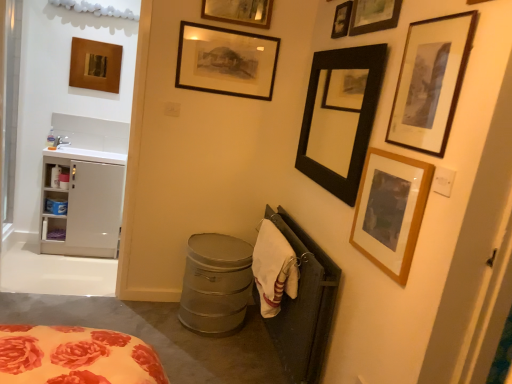
Image resolution: width=512 pixels, height=384 pixels. What do you see at coordinates (430, 82) in the screenshot?
I see `wooden framed print at upper right, the 8th picture frame positioned from the left` at bounding box center [430, 82].

Where is `wooden framed print at upper right, the 1th picture frame when ordered from right to left`? Image resolution: width=512 pixels, height=384 pixels. wooden framed print at upper right, the 1th picture frame when ordered from right to left is located at coordinates (430, 82).

The height and width of the screenshot is (384, 512). Describe the element at coordinates (390, 210) in the screenshot. I see `wooden picture frame at upper right, the 3th picture frame in the right-to-left sequence` at that location.

The image size is (512, 384). I want to click on black metal radiator at lower right, so click(304, 305).

Where is `matte black picture frame at upper center, the 2th picture frame from the left`? The height and width of the screenshot is (384, 512). matte black picture frame at upper center, the 2th picture frame from the left is located at coordinates tap(226, 61).

Where is `white matte cabinet at left`? This screenshot has width=512, height=384. white matte cabinet at left is located at coordinates (83, 203).

The width and height of the screenshot is (512, 384). What are the coordinates of `wooden picture frame at upper left, arranged as the 8th picture frame when viewed from the right` in the screenshot? It's located at (95, 65).

Would you say metallic gray trash can at lower center is part of black matte picture frame at upper right, which is the 5th picture frame from right to left,'s contents?

No, metallic gray trash can at lower center is not surrounded by black matte picture frame at upper right, which is the 5th picture frame from right to left.

Is black matte picture frame at upper right, the fourth picture frame positioned from the left, not close to metallic gray trash can at lower center?

black matte picture frame at upper right, the fourth picture frame positioned from the left, is near metallic gray trash can at lower center, not far away.

Considering the positions of objects black matte picture frame at upper right, which is the 5th picture frame from right to left, and metallic gray trash can at lower center in the image provided, who is more to the right, black matte picture frame at upper right, which is the 5th picture frame from right to left, or metallic gray trash can at lower center?

Positioned to the right is black matte picture frame at upper right, which is the 5th picture frame from right to left.

From the image's perspective, does wooden picture frame at upper right, acting as the 7th picture frame starting from the left, appear lower than white glossy sink at left?

No, from the image's perspective, wooden picture frame at upper right, acting as the 7th picture frame starting from the left, is not below white glossy sink at left.

How many degrees apart are the facing directions of wooden picture frame at upper right, arranged as the second picture frame when viewed from the right, and white glossy sink at left?

The angle between the facing direction of wooden picture frame at upper right, arranged as the second picture frame when viewed from the right, and the facing direction of white glossy sink at left is 90 degrees.

Considering their positions, is wooden picture frame at upper right, arranged as the second picture frame when viewed from the right, located in front of or behind white glossy sink at left?

Visually, wooden picture frame at upper right, arranged as the second picture frame when viewed from the right, is located in front of white glossy sink at left.

Find the location of `sink on the left of wooden picture frame at upper right, arranged as the second picture frame when viewed from the right`. sink on the left of wooden picture frame at upper right, arranged as the second picture frame when viewed from the right is located at coordinates (87, 155).

From the picture: Considering the sizes of objects white cotton towel at lower right and white plastic cabinet at left in the image provided, who is shorter, white cotton towel at lower right or white plastic cabinet at left?

With less height is white plastic cabinet at left.

In the scene shown: Is white cotton towel at lower right aimed at white plastic cabinet at left?

No, white cotton towel at lower right is not facing towards white plastic cabinet at left.

Considering the sizes of objects white cotton towel at lower right and white plastic cabinet at left in the image provided, who is smaller, white cotton towel at lower right or white plastic cabinet at left?

white plastic cabinet at left is smaller.

From the picture: Which is further, [270,261] or [60,209]?

The point [60,209] is more distant.

In the scene shown: Can you see wooden picture frame at upper right, acting as the 7th picture frame starting from the left, touching metallic gray trash can at lower center?

wooden picture frame at upper right, acting as the 7th picture frame starting from the left, and metallic gray trash can at lower center are clearly separated.

From the picture: Choose the correct answer: Is wooden picture frame at upper right, acting as the 7th picture frame starting from the left, inside metallic gray trash can at lower center or outside it?

wooden picture frame at upper right, acting as the 7th picture frame starting from the left, exists outside the volume of metallic gray trash can at lower center.

This screenshot has width=512, height=384. What are the coordinates of `the 8th picture frame located above the metallic gray trash can at lower center (from a real-world perspective)` in the screenshot? It's located at (374, 16).

Is wooden picture frame at upper right, arranged as the second picture frame when viewed from the right, taller than metallic gray trash can at lower center?

No.

Which of these two, matte black picture frame at upper center, the 2th picture frame from the left, or white cotton towel at lower right, stands taller?

With more height is white cotton towel at lower right.

From a real-world perspective, between matte black picture frame at upper center, positioned as the 7th picture frame in right-to-left order, and white cotton towel at lower right, who is vertically lower?

white cotton towel at lower right is physically lower.

Does matte black picture frame at upper center, positioned as the 7th picture frame in right-to-left order, turn towards white cotton towel at lower right?

No, matte black picture frame at upper center, positioned as the 7th picture frame in right-to-left order, is not turned towards white cotton towel at lower right.

Who is more distant, matte black picture frame at upper center, the 2th picture frame from the left, or white cotton towel at lower right?

matte black picture frame at upper center, the 2th picture frame from the left.

Are matte black picture frame at upper center, the 2th picture frame from the left, and wooden picture frame at upper right, the 6th picture frame when ordered from left to right, making contact?

No, matte black picture frame at upper center, the 2th picture frame from the left, is not making contact with wooden picture frame at upper right, the 6th picture frame when ordered from left to right.

Is matte black picture frame at upper center, the 2th picture frame from the left, at the right side of wooden picture frame at upper right, the 3th picture frame in the right-to-left sequence?

In fact, matte black picture frame at upper center, the 2th picture frame from the left, is to the left of wooden picture frame at upper right, the 3th picture frame in the right-to-left sequence.

Considering the relative positions of matte black picture frame at upper center, the 2th picture frame from the left, and wooden picture frame at upper right, the 3th picture frame in the right-to-left sequence, in the image provided, is matte black picture frame at upper center, the 2th picture frame from the left, behind wooden picture frame at upper right, the 3th picture frame in the right-to-left sequence,?

Yes, it is.

Could you tell me if matte black picture frame at upper center, positioned as the 7th picture frame in right-to-left order, is turned towards wooden picture frame at upper right, the 6th picture frame when ordered from left to right?

Yes, matte black picture frame at upper center, positioned as the 7th picture frame in right-to-left order, is facing wooden picture frame at upper right, the 6th picture frame when ordered from left to right.

Is point (60, 239) closer or farther from the camera than point (359, 34)?

Point (60, 239) is positioned farther from the camera compared to point (359, 34).

Based on the photo, from a real-world perspective, is white matte cabinet at left under wooden picture frame at upper right, arranged as the second picture frame when viewed from the right?

Yes, from a real-world perspective, white matte cabinet at left is beneath wooden picture frame at upper right, arranged as the second picture frame when viewed from the right.

From the image's perspective, which picture frame is the 3rd one above the metallic gray trash can at lower center? Please provide its 2D coordinates.

[(340, 118)]

Where is `sink lying on the left of wooden picture frame at upper right, acting as the 7th picture frame starting from the left`? Image resolution: width=512 pixels, height=384 pixels. sink lying on the left of wooden picture frame at upper right, acting as the 7th picture frame starting from the left is located at coordinates (87, 155).

From the picture: Looking at the image, which one is located further to wooden framed print at upper right, the 8th picture frame positioned from the left, white glossy sink at left or wooden framed picture at upper center, which ranks as the 3th picture frame in left-to-right order?

white glossy sink at left is further to wooden framed print at upper right, the 8th picture frame positioned from the left.

Based on their spatial positions, is wooden picture frame at upper left, the 1th picture frame from the left, or wooden framed picture at upper center, the sixth picture frame from the right, closer to white glossy sink at left?

Among the two, wooden picture frame at upper left, the 1th picture frame from the left, is located nearer to white glossy sink at left.

Looking at the image, which one is located further to white plastic cabinet at left, wooden picture frame at upper left, arranged as the 8th picture frame when viewed from the right, or matte black picture frame at upper center, the 2th picture frame from the left?

matte black picture frame at upper center, the 2th picture frame from the left, is positioned further to the anchor white plastic cabinet at left.

From the image, which object appears to be farther from white cotton towel at lower right, wooden framed picture at upper center, the sixth picture frame from the right, or white matte cabinet at left?

white matte cabinet at left.

From the image, which object appears to be farther from wooden picture frame at upper left, arranged as the 8th picture frame when viewed from the right, white glossy sink at left or matte black picture frame at upper center, the 2th picture frame from the left?

matte black picture frame at upper center, the 2th picture frame from the left, lies further to wooden picture frame at upper left, arranged as the 8th picture frame when viewed from the right, than the other object.

Based on their spatial positions, is wooden framed picture at upper center, which ranks as the 3th picture frame in left-to-right order, or black metal radiator at lower right closer to white plastic cabinet at left?

The object closer to white plastic cabinet at left is wooden framed picture at upper center, which ranks as the 3th picture frame in left-to-right order.

Based on their spatial positions, is black metal radiator at lower right or white plastic cabinet at left closer to white matte cabinet at left?

white plastic cabinet at left is positioned closer to the anchor white matte cabinet at left.

Estimate the real-world distances between objects in this image. Which object is closer to white plastic cabinet at left, black metal radiator at lower right or wooden framed picture at upper center, the sixth picture frame from the right?

Based on the image, wooden framed picture at upper center, the sixth picture frame from the right, appears to be nearer to white plastic cabinet at left.

The image size is (512, 384). I want to click on cabinetry between wooden framed picture at upper center, the sixth picture frame from the right, and metallic gray trash can at lower center vertically, so click(83, 203).

You are a GUI agent. You are given a task and a screenshot of the screen. Output one action in this format:
    pyautogui.click(x=<x>, y=<y>)
    Task: Click on the picture frame situated between white glossy sink at left and matte black picture frame at upper center, the 2th picture frame from the left, from left to right
    Image resolution: width=512 pixels, height=384 pixels.
    Given the screenshot: What is the action you would take?
    pyautogui.click(x=95, y=65)

Find the location of a particular element. The width and height of the screenshot is (512, 384). sink between white plastic cabinet at left and wooden picture frame at upper right, the 3th picture frame in the right-to-left sequence, from left to right is located at coordinates (87, 155).

The image size is (512, 384). In order to click on appliance between white glossy sink at left and wooden picture frame at upper right, the 6th picture frame when ordered from left to right, from left to right in this screenshot , I will do `click(216, 283)`.